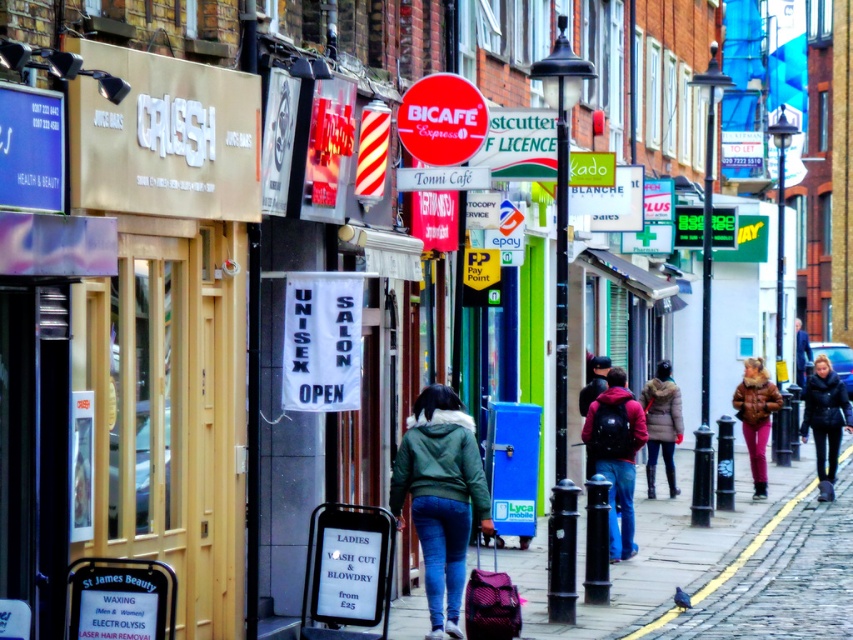
Question: Which object is positioned farthest from the brown fuzzy coat at right?

Choices:
 (A) red matte backpack at center
 (B) cobblestone pavement at lower right
 (C) red plastic sign at center

Answer: (C)

Question: Which object is closer to the camera taking this photo?

Choices:
 (A) dark brown fur coat at center
 (B) red plastic sign at center
 (C) red matte backpack at center

Answer: (B)

Question: Is dark brown fur coat at center smaller than cobblestone pavement at lower right?

Choices:
 (A) no
 (B) yes

Answer: (B)

Question: Among these objects, which one is farthest from the camera?

Choices:
 (A) dark brown fur coat at center
 (B) black leather jacket at right
 (C) red matte backpack at center
 (D) green fuzzy jacket at center

Answer: (B)

Question: Can you confirm if black leather jacket at right is positioned below dark brown fur coat at center?

Choices:
 (A) no
 (B) yes

Answer: (B)

Question: Does red plastic sign at center appear on the right side of matte purple suitcase at lower center?

Choices:
 (A) yes
 (B) no

Answer: (B)